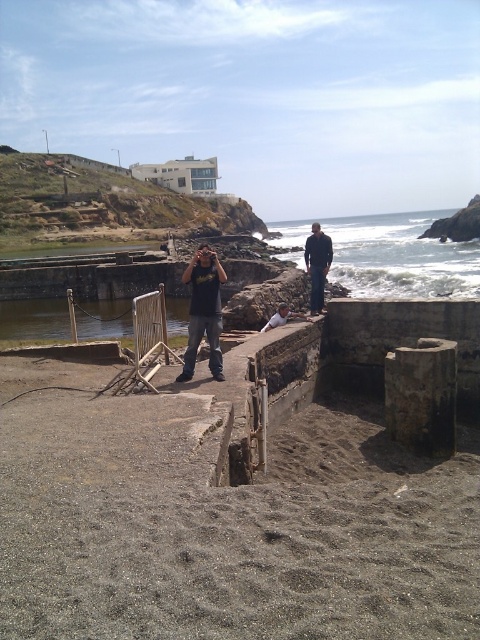
Question: Considering the relative positions of gray gravel at center and matte black t-shirt at center in the image provided, where is gray gravel at center located with respect to matte black t-shirt at center?

Choices:
 (A) below
 (B) above

Answer: (A)

Question: Does matte black t-shirt at center appear under dark blue jeans at center?

Choices:
 (A) no
 (B) yes

Answer: (B)

Question: Estimate the real-world distances between objects in this image. Which object is closer to the blue ocean water at center?

Choices:
 (A) dark blue jeans at center
 (B) gray gravel at center

Answer: (B)

Question: Which point is closer to the camera taking this photo?

Choices:
 (A) (316, 257)
 (B) (20, 499)
 (C) (406, 236)
 (D) (202, 316)

Answer: (B)

Question: Does gray gravel at center appear under matte black t-shirt at center?

Choices:
 (A) yes
 (B) no

Answer: (A)

Question: Among these points, which one is farthest from the camera?

Choices:
 (A) (325, 224)
 (B) (184, 428)

Answer: (A)